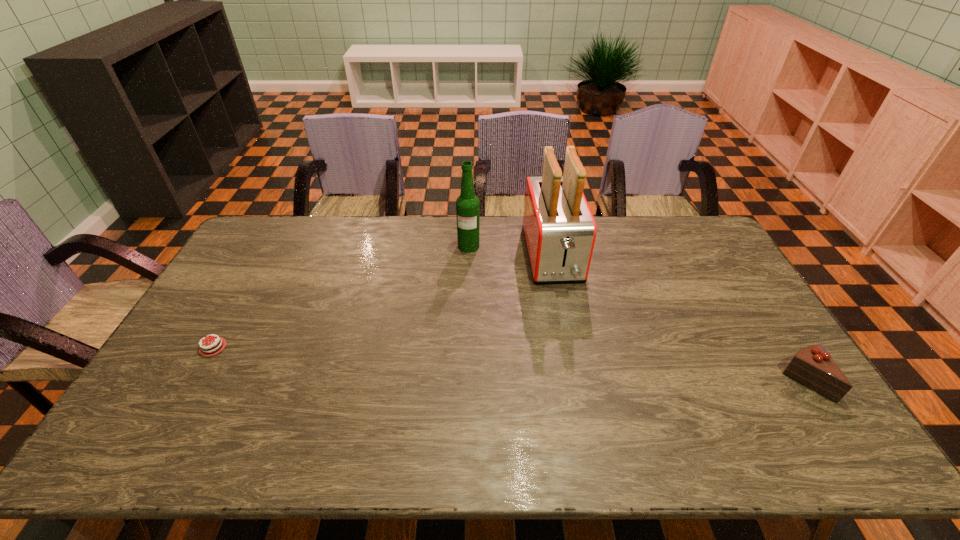
Where is `vacant space that satisfies the following two spatial constraints: 1. on the front side of the third object from left to right; 2. on the left side of the rightmost object`? vacant space that satisfies the following two spatial constraints: 1. on the front side of the third object from left to right; 2. on the left side of the rightmost object is located at coordinates (577, 382).

You are a GUI agent. You are given a task and a screenshot of the screen. Output one action in this format:
    pyautogui.click(x=<x>, y=<y>)
    Task: Click on the vacant space that satisfies the following two spatial constraints: 1. on the front side of the third tallest object; 2. on the left side of the second object from right to left
    
    Given the screenshot: What is the action you would take?
    pyautogui.click(x=577, y=382)